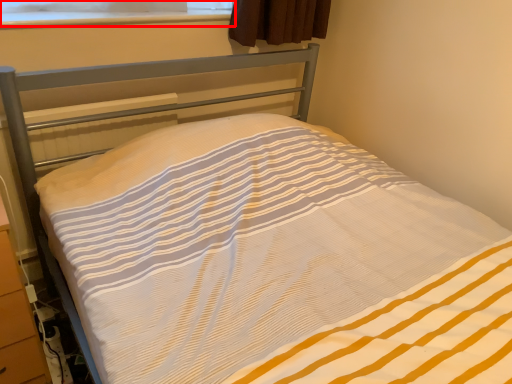
Question: From the image's perspective, considering the relative positions of window screen (annotated by the red box) and dresser in the image provided, where is window screen (annotated by the red box) located with respect to the staircase?

Choices:
 (A) below
 (B) above

Answer: (B)